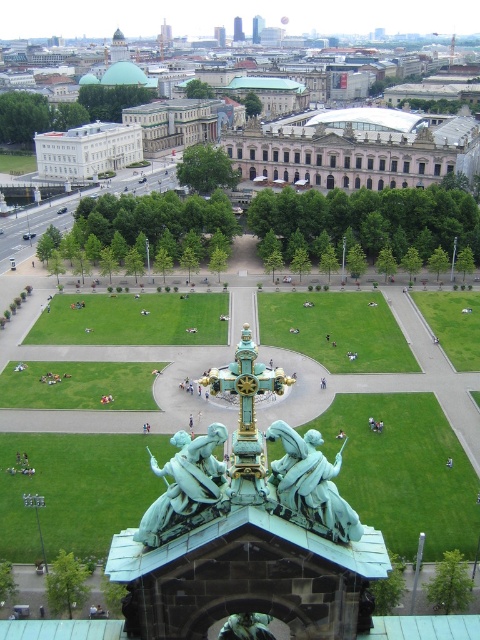
Can you confirm if white marble palace at left is positioned to the left of green patinated bronze statue at center?

Correct, you'll find white marble palace at left to the left of green patinated bronze statue at center.

Which of these two, white marble palace at left or green patinated bronze statue at center, stands taller?

Standing taller between the two is white marble palace at left.

Locate an element on the screen. white marble palace at left is located at coordinates (86, 150).

Locate an element on the screen. This screenshot has width=480, height=640. white marble palace at left is located at coordinates (86, 150).

Between point (315, 456) and point (76, 170), which one is positioned in front?

Point (315, 456)

Is green patina statue at center to the left of white marble palace at left from the viewer's perspective?

In fact, green patina statue at center is to the right of white marble palace at left.

Where is `green patina statue at center`? This screenshot has width=480, height=640. green patina statue at center is located at coordinates (312, 483).

Which is above, bronze/golden statue at center or green patina statue at center?

green patina statue at center

Is bronze/golden statue at center below green patina statue at center?

Indeed, bronze/golden statue at center is positioned under green patina statue at center.

The image size is (480, 640). Find the location of `bronze/golden statue at center`. bronze/golden statue at center is located at coordinates (187, 486).